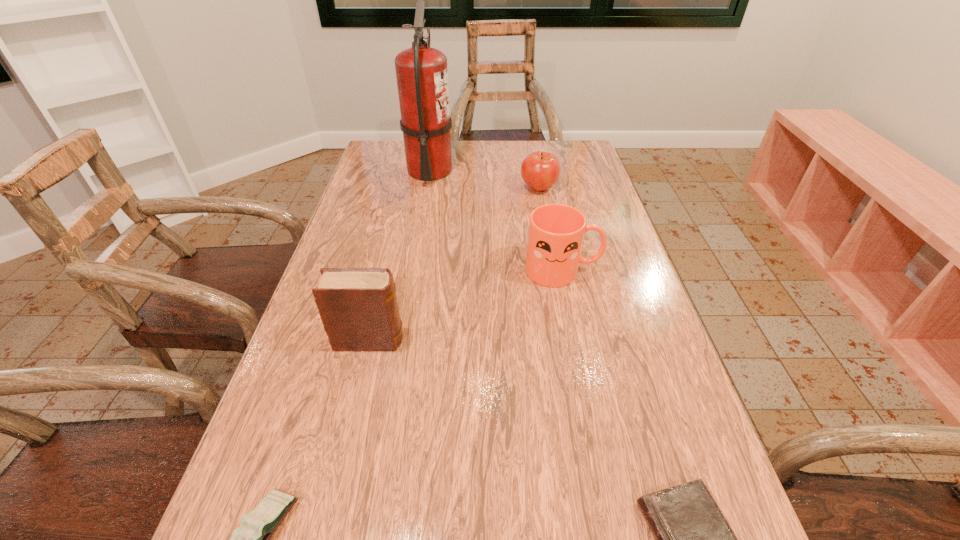
I want to click on fire extinguisher located at the left edge, so [421, 71].

At what (x,y) coordinates should I click in order to perform the action: click on diary that is at the left edge. Please return your answer as a coordinate pair (x, y). Looking at the image, I should click on (358, 307).

The height and width of the screenshot is (540, 960). I want to click on mug that is positioned at the right edge, so click(x=556, y=231).

Image resolution: width=960 pixels, height=540 pixels. In order to click on apple that is at the right edge in this screenshot , I will do `click(540, 170)`.

Find the location of a particular element. object present at the far left corner is located at coordinates (421, 71).

Image resolution: width=960 pixels, height=540 pixels. In the image, there is a desktop. In order to click on vacant space at the left edge in this screenshot , I will do `click(386, 183)`.

In the image, there is a desktop. Find the location of `free space at the right edge`. free space at the right edge is located at coordinates (695, 438).

Where is `free space at the far left corner of the desktop`? The height and width of the screenshot is (540, 960). free space at the far left corner of the desktop is located at coordinates (394, 162).

The width and height of the screenshot is (960, 540). I want to click on free area in between the tallest object and the apple, so click(484, 180).

This screenshot has width=960, height=540. Find the location of `unoccupied position between the fire extinguisher and the fourth tallest object`. unoccupied position between the fire extinguisher and the fourth tallest object is located at coordinates (484, 180).